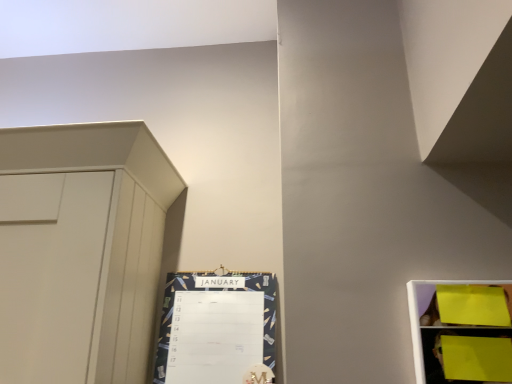
Question: From the image's perspective, is dark blue textured calendar at center-left under yellow paper at right?

Choices:
 (A) no
 (B) yes

Answer: (B)

Question: Is dark blue textured calendar at center-left in contact with yellow paper at right?

Choices:
 (A) no
 (B) yes

Answer: (A)

Question: Is dark blue textured calendar at center-left further to camera compared to yellow paper at right?

Choices:
 (A) no
 (B) yes

Answer: (B)

Question: Does dark blue textured calendar at center-left have a larger size compared to yellow paper at right?

Choices:
 (A) yes
 (B) no

Answer: (A)

Question: Considering the relative sizes of dark blue textured calendar at center-left and yellow paper at right in the image provided, is dark blue textured calendar at center-left shorter than yellow paper at right?

Choices:
 (A) no
 (B) yes

Answer: (A)

Question: Does dark blue textured calendar at center-left appear on the left side of yellow paper at right?

Choices:
 (A) no
 (B) yes

Answer: (B)

Question: Does yellow paper at right come behind dark blue textured calendar at center-left?

Choices:
 (A) yes
 (B) no

Answer: (B)

Question: Is yellow paper at right not inside dark blue textured calendar at center-left?

Choices:
 (A) yes
 (B) no

Answer: (A)

Question: From the image's perspective, is yellow paper at right on top of dark blue textured calendar at center-left?

Choices:
 (A) no
 (B) yes

Answer: (B)

Question: From a real-world perspective, is yellow paper at right on top of dark blue textured calendar at center-left?

Choices:
 (A) no
 (B) yes

Answer: (A)

Question: Can you confirm if yellow paper at right is smaller than dark blue textured calendar at center-left?

Choices:
 (A) yes
 (B) no

Answer: (A)

Question: Is yellow paper at right at the left side of dark blue textured calendar at center-left?

Choices:
 (A) no
 (B) yes

Answer: (A)

Question: Based on their sizes in the image, would you say dark blue textured calendar at center-left is bigger or smaller than yellow paper at right?

Choices:
 (A) small
 (B) big

Answer: (B)